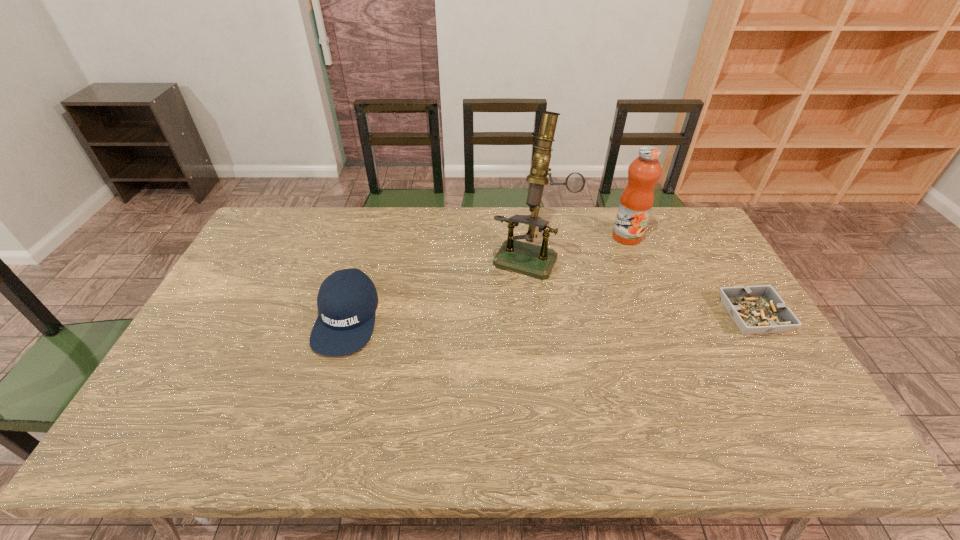
Find the location of `vacant area situated on the front label of the third shortest object`. vacant area situated on the front label of the third shortest object is located at coordinates (605, 279).

Locate an element on the screen. The height and width of the screenshot is (540, 960). vacant space located on the front label of the third shortest object is located at coordinates (611, 268).

The width and height of the screenshot is (960, 540). I want to click on blank space located 0.170m on the front label of the third shortest object, so click(608, 274).

You are a GUI agent. You are given a task and a screenshot of the screen. Output one action in this format:
    pyautogui.click(x=<x>, y=<y>)
    Task: Click on the vacant space positioned 0.200m at the eyepiece of the tallest object
    The height and width of the screenshot is (540, 960).
    Given the screenshot: What is the action you would take?
    pyautogui.click(x=496, y=323)

This screenshot has width=960, height=540. What are the coordinates of `blank area located 0.380m at the eyepiece of the tallest object` in the screenshot? It's located at (472, 372).

You are a GUI agent. You are given a task and a screenshot of the screen. Output one action in this format:
    pyautogui.click(x=<x>, y=<y>)
    Task: Click on the free space located 0.340m at the eyepiece of the tallest object
    
    Given the screenshot: What is the action you would take?
    pyautogui.click(x=478, y=360)

This screenshot has height=540, width=960. What are the coordinates of `fruit juice that is at the far edge` in the screenshot? It's located at (637, 199).

The height and width of the screenshot is (540, 960). I want to click on microscope located at the far edge, so click(x=538, y=261).

Identify the location of object that is at the right edge. Image resolution: width=960 pixels, height=540 pixels. pyautogui.click(x=759, y=309).

Locate an element on the screen. The height and width of the screenshot is (540, 960). free space at the far edge is located at coordinates (574, 244).